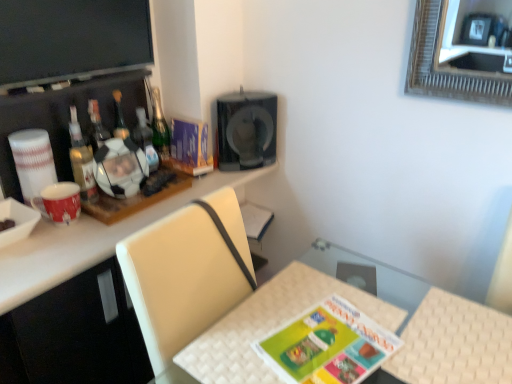
Question: Is glossy plastic speaker at upper center aimed at flat matte screen at upper left?

Choices:
 (A) no
 (B) yes

Answer: (A)

Question: Is glossy plastic speaker at upper center positioned before flat matte screen at upper left?

Choices:
 (A) no
 (B) yes

Answer: (A)

Question: Is glossy plastic speaker at upper center shorter than flat matte screen at upper left?

Choices:
 (A) no
 (B) yes

Answer: (A)

Question: Is flat matte screen at upper left a part of glossy plastic speaker at upper center?

Choices:
 (A) no
 (B) yes

Answer: (A)

Question: Is glossy plastic speaker at upper center outside flat matte screen at upper left?

Choices:
 (A) yes
 (B) no

Answer: (A)

Question: Are glossy plastic speaker at upper center and flat matte screen at upper left far apart?

Choices:
 (A) yes
 (B) no

Answer: (B)

Question: Considering the relative positions of green glass bottle at upper center, which appears as the fourth bottle when viewed from the left, and matte green board game at center in the image provided, is green glass bottle at upper center, which appears as the fourth bottle when viewed from the left, to the right of matte green board game at center from the viewer's perspective?

Choices:
 (A) no
 (B) yes

Answer: (A)

Question: Does green glass bottle at upper center, which appears as the fourth bottle when viewed from the left, lie behind matte green board game at center?

Choices:
 (A) no
 (B) yes

Answer: (B)

Question: From the image's perspective, is green glass bottle at upper center, which appears as the fourth bottle when viewed from the left, over matte green board game at center?

Choices:
 (A) no
 (B) yes

Answer: (B)

Question: Is green glass bottle at upper center, which appears as the fourth bottle when viewed from the left, facing towards matte green board game at center?

Choices:
 (A) yes
 (B) no

Answer: (B)

Question: Can matte green board game at center be found inside green glass bottle at upper center, which appears as the fourth bottle when viewed from the left?

Choices:
 (A) no
 (B) yes

Answer: (A)

Question: Is green glass bottle at upper center, which appears as the fourth bottle when viewed from the left, facing away from matte green board game at center?

Choices:
 (A) no
 (B) yes

Answer: (A)

Question: Is matte purple magazine at upper center behind white woven table at lower center?

Choices:
 (A) no
 (B) yes

Answer: (B)